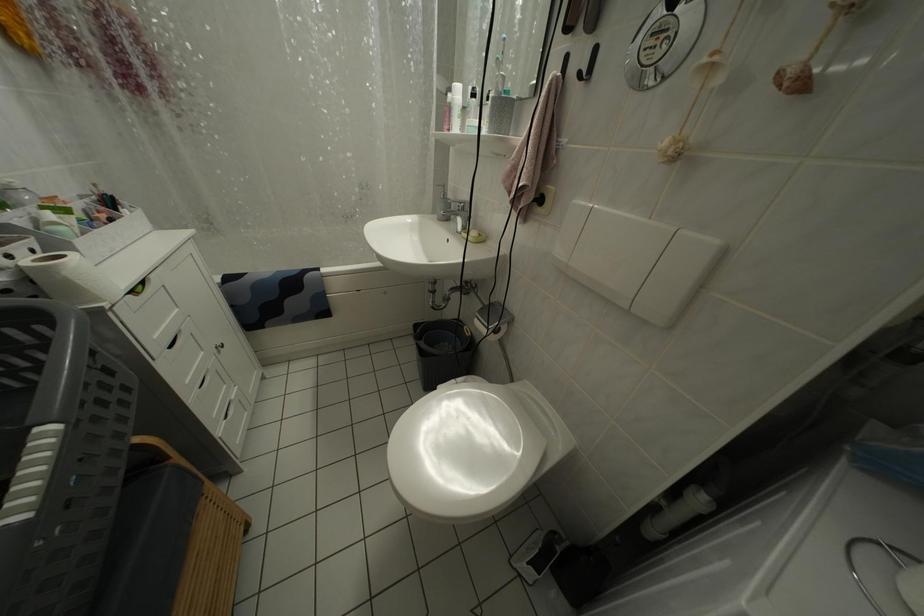
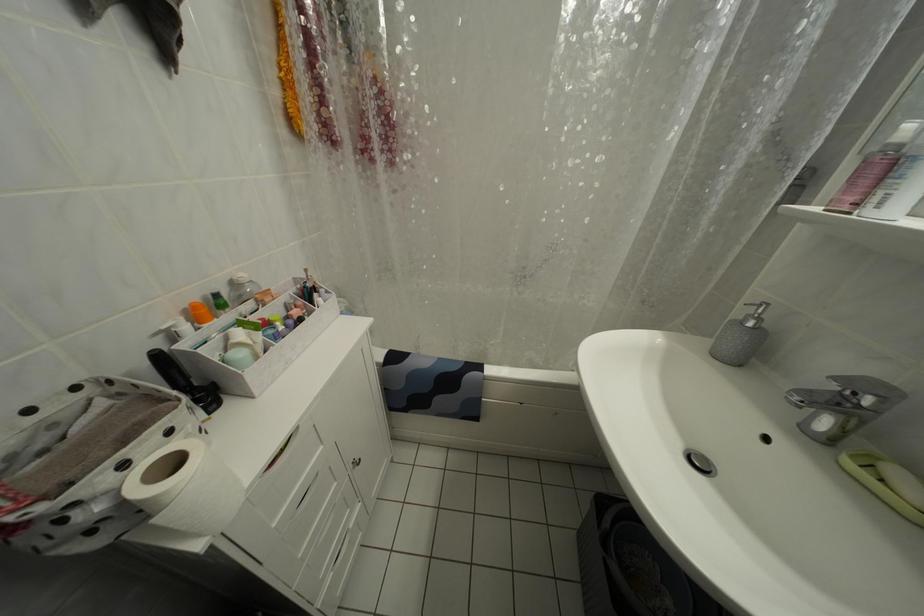
Question: Based on the continuous images, in which direction is the camera rotating? Reply with the corresponding letter.

Choices:
 (A) Left
 (B) Right
 (C) Up
 (D) Down

Answer: (A)